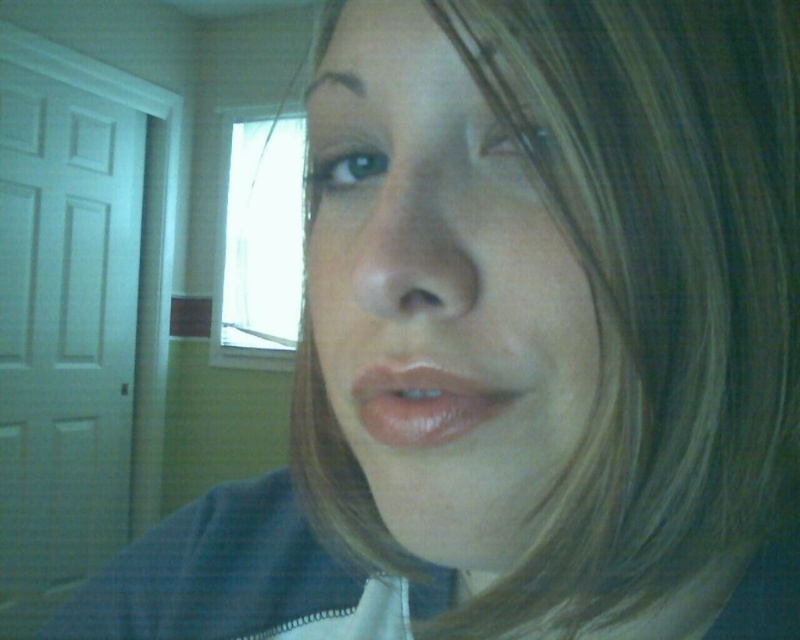
You are a photographer adjusting lighting for a portrait session. You need to ensure the subject with the smooth skin face at center and shiny pink lips at center is well lit. Considering their relative sizes in the frame, which part might require more focused lighting to avoid being overshadowed?

The shiny pink lips at center might require more focused lighting since the smooth skin face at center is much taller, potentially casting shadows or requiring different light distribution.